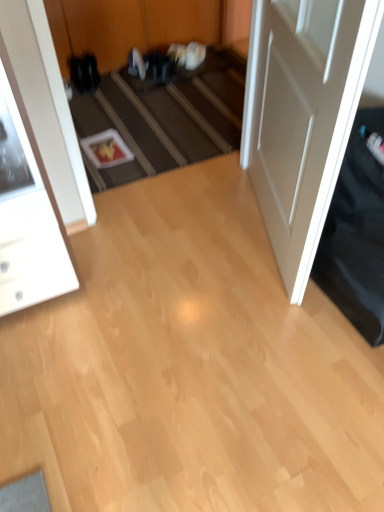
Question: Can you confirm if white matte door at right is wider than white glossy cabinet at left?

Choices:
 (A) no
 (B) yes

Answer: (A)

Question: Is white matte door at right located outside white glossy cabinet at left?

Choices:
 (A) no
 (B) yes

Answer: (B)

Question: Is white glossy cabinet at left completely or partially inside white matte door at right?

Choices:
 (A) yes
 (B) no

Answer: (B)

Question: Considering the relative sizes of white matte door at right and white glossy cabinet at left in the image provided, is white matte door at right taller than white glossy cabinet at left?

Choices:
 (A) yes
 (B) no

Answer: (A)

Question: Is white matte door at right closer to camera compared to white glossy cabinet at left?

Choices:
 (A) yes
 (B) no

Answer: (A)

Question: Considering the relative sizes of white matte door at right and white glossy cabinet at left in the image provided, is white matte door at right thinner than white glossy cabinet at left?

Choices:
 (A) no
 (B) yes

Answer: (B)

Question: Can you confirm if carpeted stairs at center is wider than white matte door at right?

Choices:
 (A) yes
 (B) no

Answer: (B)

Question: Is carpeted stairs at center taller than white matte door at right?

Choices:
 (A) yes
 (B) no

Answer: (B)

Question: From the image's perspective, is carpeted stairs at center below white matte door at right?

Choices:
 (A) yes
 (B) no

Answer: (B)

Question: From the image's perspective, is carpeted stairs at center above white matte door at right?

Choices:
 (A) yes
 (B) no

Answer: (A)

Question: Is carpeted stairs at center located outside white matte door at right?

Choices:
 (A) yes
 (B) no

Answer: (A)

Question: From a real-world perspective, is carpeted stairs at center physically above white matte door at right?

Choices:
 (A) no
 (B) yes

Answer: (A)

Question: From a real-world perspective, is white glossy cabinet at left over white matte door at right?

Choices:
 (A) yes
 (B) no

Answer: (B)